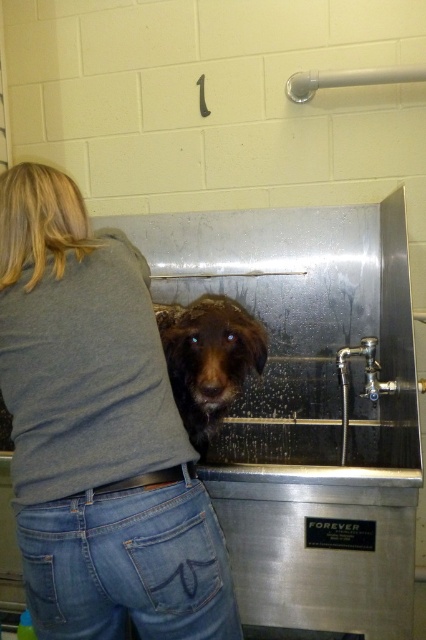
What is the 2D coordinate of the gray cotton shirt at center?

The gray cotton shirt at center is located at the 2D coordinate point of (97,433).

You are a pet groomer working in the Forever sink area. You notice the gray cotton shirt at center and the wet brown fur at center. Which item is closer to the bottom of the sink?

The gray cotton shirt at center is below the wet brown fur at center, so the gray cotton shirt at center is closer to the bottom of the sink.

You are a photographer standing 50 inches away from the gray cotton shirt at center. Can you reach it without moving closer?

The gray cotton shirt at center is 38.09 inches away from the viewer. Since you are standing 50 inches away, you are too far to reach it without moving closer.